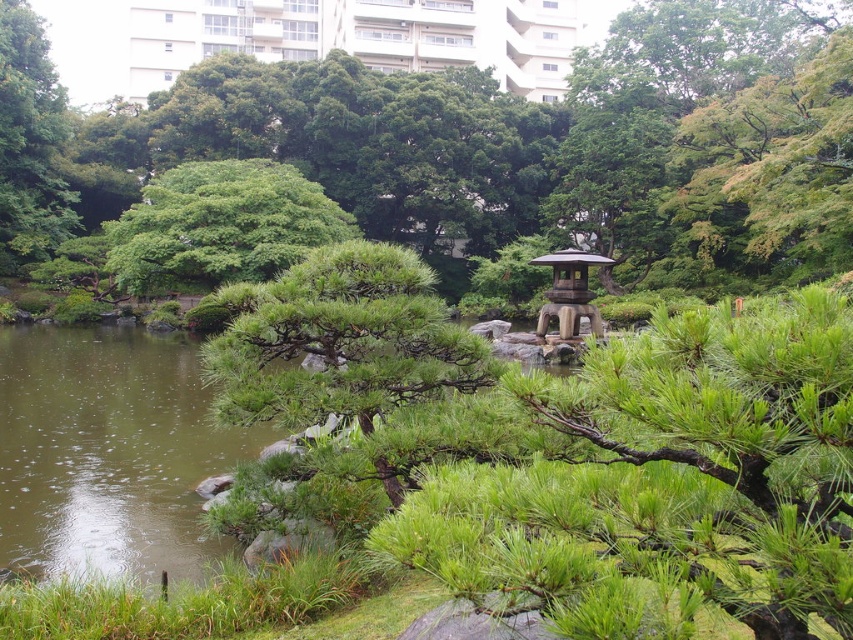
You are standing at the point marked by coordinates point (219, 227) in the Japanese garden. Looking around, you see a green leafy tree at center. Which direction should you walk to reach the traditional Japanese lantern on the right of the pine tree?

The point (219, 227) marks the green leafy tree at center. To reach the traditional Japanese lantern on the right of the pine tree, you should walk to the right.

You are a gardener planning to place a new decorative stone between the green matte tree at center and the wooden lantern at center. Based on their sizes, which object should the stone be closer to?

The green matte tree at center is bigger than the wooden lantern at center. Therefore, the stone should be placed closer to the smaller wooden lantern at center to maintain visual balance.